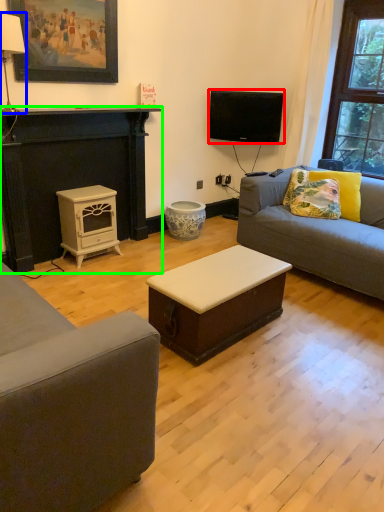
Question: Considering the real-world distances, which object is farthest from television (highlighted by a red box)? lamp (highlighted by a blue box) or fireplace (highlighted by a green box)?

Choices:
 (A) lamp
 (B) fireplace

Answer: (A)